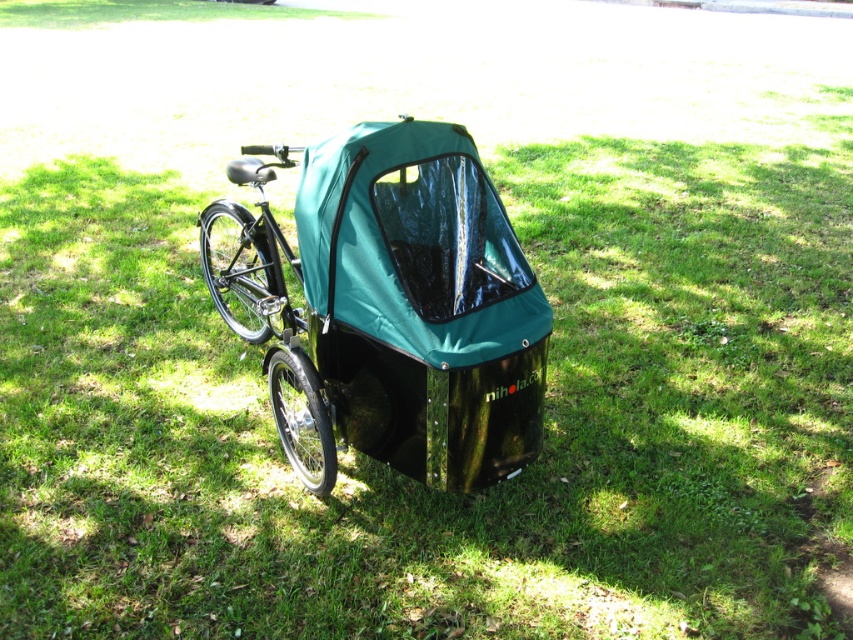
Who is higher up, teal glossy baby carriage at center or black matte bicycle at left?

Positioned higher is black matte bicycle at left.

Who is shorter, teal glossy baby carriage at center or black matte bicycle at left?

black matte bicycle at left is shorter.

Does point (370, 212) lie behind point (212, 227)?

No, it is not.

The height and width of the screenshot is (640, 853). I want to click on teal glossy baby carriage at center, so click(387, 307).